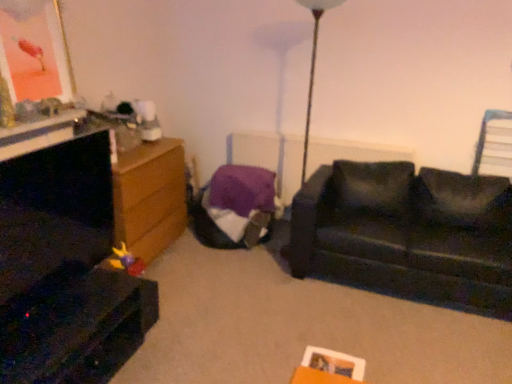
What do you see at coordinates (270, 157) in the screenshot?
I see `purple fabric radiator at center` at bounding box center [270, 157].

The width and height of the screenshot is (512, 384). Describe the element at coordinates (236, 207) in the screenshot. I see `purple fabric bean bag at center` at that location.

What do you see at coordinates (65, 269) in the screenshot?
I see `dark wood entertainment center at left` at bounding box center [65, 269].

I want to click on metallic blue swivel chair at upper right, so [494, 145].

Describe the element at coordinates (407, 233) in the screenshot. I see `black leather couch at right` at that location.

Where is `purple fabric radiator at center`? The image size is (512, 384). purple fabric radiator at center is located at coordinates [x=270, y=157].

Does metallic blue swivel chair at upper right lie behind plush yellow and purple toy at lower left?

That is True.

From the image's perspective, would you say metallic blue swivel chair at upper right is shown under plush yellow and purple toy at lower left?

No, from the image's perspective, metallic blue swivel chair at upper right is not below plush yellow and purple toy at lower left.

Is metallic blue swivel chair at upper right shorter than plush yellow and purple toy at lower left?

No.

Is metallic blue swivel chair at upper right completely or partially outside of plush yellow and purple toy at lower left?

That's correct, metallic blue swivel chair at upper right is outside of plush yellow and purple toy at lower left.

Is metallic blue swivel chair at upper right positioned with its back to metallic gold picture frame at upper left?

That's not correct — metallic blue swivel chair at upper right is not looking away from metallic gold picture frame at upper left.

From the picture: From a real-world perspective, is metallic blue swivel chair at upper right physically located above or below metallic gold picture frame at upper left?

metallic blue swivel chair at upper right is below metallic gold picture frame at upper left.

Which of these two, metallic blue swivel chair at upper right or metallic gold picture frame at upper left, is smaller?

metallic blue swivel chair at upper right.

Can metallic gold picture frame at upper left be found inside metallic blue swivel chair at upper right?

No, metallic gold picture frame at upper left is not inside metallic blue swivel chair at upper right.

From a real-world perspective, which is physically below, metallic gold picture frame at upper left or black leather couch at right?

From a 3D spatial view, black leather couch at right is below.

Does metallic gold picture frame at upper left have a greater height compared to black leather couch at right?

In fact, metallic gold picture frame at upper left may be shorter than black leather couch at right.

From the image's perspective, is metallic gold picture frame at upper left located above or below black leather couch at right?

Clearly, from the image's perspective, metallic gold picture frame at upper left is above black leather couch at right.

Is metallic gold picture frame at upper left in front of or behind black leather couch at right in the image?

metallic gold picture frame at upper left is in front of black leather couch at right.

Is purple fabric bean bag at center looking in the opposite direction of dark wood entertainment center at left?

No, purple fabric bean bag at center is not facing away from dark wood entertainment center at left.

Is purple fabric bean bag at center wider than dark wood entertainment center at left?

Indeed, purple fabric bean bag at center has a greater width compared to dark wood entertainment center at left.

Measure the distance between purple fabric bean bag at center and dark wood entertainment center at left.

purple fabric bean bag at center is 3.91 feet away from dark wood entertainment center at left.

Which is behind, purple fabric bean bag at center or dark wood entertainment center at left?

purple fabric bean bag at center is further away from the camera.

Is dark wood entertainment center at left with purple fabric bean bag at center?

dark wood entertainment center at left and purple fabric bean bag at center are clearly separated.

Who is more distant, dark wood entertainment center at left or purple fabric bean bag at center?

Positioned behind is purple fabric bean bag at center.

In the scene shown: Is purple fabric bean bag at center at the back of dark wood entertainment center at left?

No, purple fabric bean bag at center is not at the back of dark wood entertainment center at left.

Is metallic gold picture frame at upper left looking in the opposite direction of plush yellow and purple toy at lower left?

No, metallic gold picture frame at upper left's orientation is not away from plush yellow and purple toy at lower left.

Considering the positions of objects metallic gold picture frame at upper left and plush yellow and purple toy at lower left in the image provided, who is behind, metallic gold picture frame at upper left or plush yellow and purple toy at lower left?

plush yellow and purple toy at lower left is more distant.

Based on the photo, is metallic gold picture frame at upper left shorter than plush yellow and purple toy at lower left?

No, metallic gold picture frame at upper left is not shorter than plush yellow and purple toy at lower left.

From the picture: Is metallic gold picture frame at upper left spatially inside plush yellow and purple toy at lower left, or outside of it?

metallic gold picture frame at upper left is not inside plush yellow and purple toy at lower left, it's outside.

Is there a large distance between wooden chest of drawers at left and metallic gold table lamp at center?

Yes.

Image resolution: width=512 pixels, height=384 pixels. In order to click on table lamp on the right of wooden chest of drawers at left in this screenshot , I will do pyautogui.click(x=313, y=65).

Considering the relative sizes of wooden chest of drawers at left and metallic gold table lamp at center in the image provided, is wooden chest of drawers at left thinner than metallic gold table lamp at center?

No.

Considering the relative positions of wooden chest of drawers at left and metallic gold table lamp at center in the image provided, is wooden chest of drawers at left to the right of metallic gold table lamp at center from the viewer's perspective?

In fact, wooden chest of drawers at left is to the left of metallic gold table lamp at center.

Where is `toy on the left side of metallic blue swivel chair at upper right`? toy on the left side of metallic blue swivel chair at upper right is located at coordinates (127, 261).

You are a GUI agent. You are given a task and a screenshot of the screen. Output one action in this format:
    pyautogui.click(x=<x>, y=<y>)
    Task: Click on the swivel chair below the metallic gold picture frame at upper left (from a real-world perspective)
    This screenshot has height=384, width=512.
    Given the screenshot: What is the action you would take?
    tap(494, 145)

When comparing their distances from purple fabric bean bag at center, does dark wood entertainment center at left or purple fabric radiator at center seem further?

dark wood entertainment center at left is positioned further to the anchor purple fabric bean bag at center.

From the image, which object appears to be nearer to dark wood entertainment center at left, black leather couch at right or metallic gold picture frame at upper left?

metallic gold picture frame at upper left is closer to dark wood entertainment center at left.

Based on their spatial positions, is metallic gold picture frame at upper left or plush yellow and purple toy at lower left closer to metallic gold table lamp at center?

plush yellow and purple toy at lower left lies closer to metallic gold table lamp at center than the other object.

Looking at the image, which one is located further to purple fabric bean bag at center, metallic gold picture frame at upper left or metallic gold table lamp at center?

metallic gold picture frame at upper left.

Estimate the real-world distances between objects in this image. Which object is further from purple fabric bean bag at center, metallic blue swivel chair at upper right or wooden chest of drawers at left?

metallic blue swivel chair at upper right is positioned further to the anchor purple fabric bean bag at center.

Based on their spatial positions, is plush yellow and purple toy at lower left or purple fabric bean bag at center further from metallic gold picture frame at upper left?

purple fabric bean bag at center is further to metallic gold picture frame at upper left.

From the image, which object appears to be nearer to wooden chest of drawers at left, metallic gold table lamp at center or metallic gold picture frame at upper left?

Based on the image, metallic gold picture frame at upper left appears to be nearer to wooden chest of drawers at left.

Looking at the image, which one is located further to black leather couch at right, metallic blue swivel chair at upper right or metallic gold picture frame at upper left?

metallic gold picture frame at upper left is positioned further to the anchor black leather couch at right.

Identify the location of bean bag chair located between wooden chest of drawers at left and metallic blue swivel chair at upper right in the left-right direction. The image size is (512, 384). (236, 207).

Where is `bean bag chair positioned between dark wood entertainment center at left and purple fabric radiator at center from near to far`? The width and height of the screenshot is (512, 384). bean bag chair positioned between dark wood entertainment center at left and purple fabric radiator at center from near to far is located at coordinates (236, 207).

The height and width of the screenshot is (384, 512). Find the location of `toy located between wooden chest of drawers at left and black leather couch at right in the left-right direction`. toy located between wooden chest of drawers at left and black leather couch at right in the left-right direction is located at coordinates (127, 261).

I want to click on table lamp between black leather couch at right and purple fabric radiator at center along the z-axis, so click(x=313, y=65).